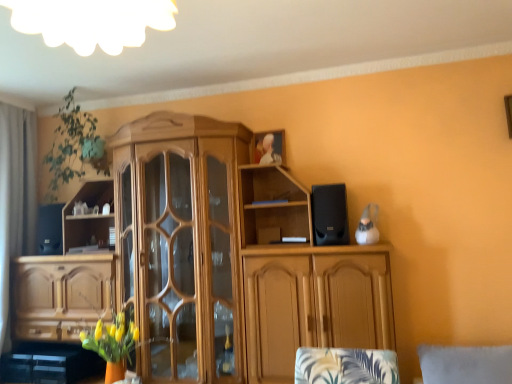
Question: Can you confirm if gray fabric curtain at left is positioned to the left of black matte speaker at left, the 2th speaker viewed from the front?

Choices:
 (A) no
 (B) yes

Answer: (B)

Question: Is black matte speaker at left, marked as the first speaker in a back-to-front arrangement, at the back of gray fabric curtain at left?

Choices:
 (A) no
 (B) yes

Answer: (B)

Question: Can black matte speaker at left, the second speaker viewed from the right, be found inside gray fabric curtain at left?

Choices:
 (A) no
 (B) yes

Answer: (A)

Question: Considering the relative sizes of gray fabric curtain at left and black matte speaker at left, the 2th speaker viewed from the front, in the image provided, is gray fabric curtain at left thinner than black matte speaker at left, the 2th speaker viewed from the front,?

Choices:
 (A) no
 (B) yes

Answer: (B)

Question: Could you tell me if gray fabric curtain at left is facing black matte speaker at left, the 2th speaker viewed from the front?

Choices:
 (A) no
 (B) yes

Answer: (B)

Question: Is gray fabric curtain at left bigger than black matte speaker at left, marked as the first speaker in a back-to-front arrangement?

Choices:
 (A) yes
 (B) no

Answer: (A)

Question: Would you say green leafy plant at upper left is a long distance from wooden cabinet at center?

Choices:
 (A) yes
 (B) no

Answer: (B)

Question: Considering the relative positions of green leafy plant at upper left and wooden cabinet at center in the image provided, is green leafy plant at upper left to the left of wooden cabinet at center from the viewer's perspective?

Choices:
 (A) yes
 (B) no

Answer: (A)

Question: Is green leafy plant at upper left taller than wooden cabinet at center?

Choices:
 (A) no
 (B) yes

Answer: (A)

Question: Can you confirm if green leafy plant at upper left is wider than wooden cabinet at center?

Choices:
 (A) yes
 (B) no

Answer: (B)

Question: Is green leafy plant at upper left in front of wooden cabinet at center?

Choices:
 (A) no
 (B) yes

Answer: (A)

Question: Is green leafy plant at upper left shorter than wooden cabinet at center?

Choices:
 (A) yes
 (B) no

Answer: (A)

Question: Does black matte speaker at left, marked as the first speaker in a back-to-front arrangement, have a lesser width compared to gray fabric curtain at left?

Choices:
 (A) no
 (B) yes

Answer: (A)